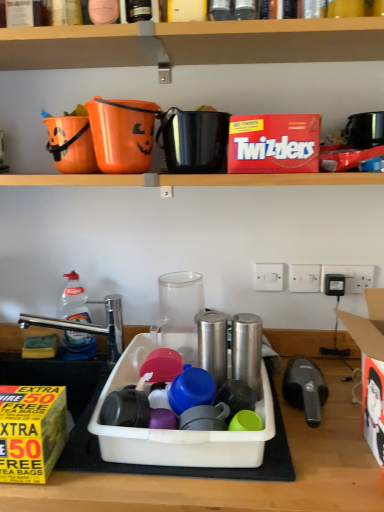
Question: Considering the relative sizes of orange plastic bucket at upper center, marked as the fifth appliance in a right-to-left arrangement, and red cardboard box at upper center, the second box from the left, in the image provided, is orange plastic bucket at upper center, marked as the fifth appliance in a right-to-left arrangement, taller than red cardboard box at upper center, the second box from the left,?

Choices:
 (A) yes
 (B) no

Answer: (A)

Question: From a real-world perspective, is orange plastic bucket at upper center, marked as the fifth appliance in a right-to-left arrangement, over red cardboard box at upper center, the first box in the right-to-left sequence?

Choices:
 (A) yes
 (B) no

Answer: (A)

Question: From the image's perspective, is orange plastic bucket at upper center, arranged as the 4th appliance when ordered from the bottom, above red cardboard box at upper center, the second box from the left?

Choices:
 (A) yes
 (B) no

Answer: (A)

Question: Is there a large distance between orange plastic bucket at upper center, the 2th appliance viewed from the top, and red cardboard box at upper center, the second box from the left?

Choices:
 (A) no
 (B) yes

Answer: (A)

Question: Is orange plastic bucket at upper center, the first appliance in the left-to-right sequence, smaller than red cardboard box at upper center, placed as the first box when sorted from back to front?

Choices:
 (A) no
 (B) yes

Answer: (B)

Question: Can you confirm if orange plastic bucket at upper center, marked as the fifth appliance in a right-to-left arrangement, is thinner than red cardboard box at upper center, the second box ordered from the bottom?

Choices:
 (A) no
 (B) yes

Answer: (A)

Question: Can you confirm if white plastic electric outlet at center, the second electric outlet from the left, is positioned to the right of chrome metallic faucet at left?

Choices:
 (A) no
 (B) yes

Answer: (B)

Question: Can you confirm if white plastic electric outlet at center, the second electric outlet from the left, is shorter than chrome metallic faucet at left?

Choices:
 (A) yes
 (B) no

Answer: (A)

Question: Can you confirm if white plastic electric outlet at center, the second electric outlet from the left, is smaller than chrome metallic faucet at left?

Choices:
 (A) yes
 (B) no

Answer: (A)

Question: Is white plastic electric outlet at center, the second electric outlet positioned from the right, looking in the opposite direction of chrome metallic faucet at left?

Choices:
 (A) yes
 (B) no

Answer: (B)

Question: Would you say white plastic electric outlet at center, the second electric outlet positioned from the right, is outside chrome metallic faucet at left?

Choices:
 (A) yes
 (B) no

Answer: (A)

Question: Does white plastic electric outlet at center, the second electric outlet positioned from the right, have a larger size compared to chrome metallic faucet at left?

Choices:
 (A) yes
 (B) no

Answer: (B)

Question: Considering the relative positions of wooden shelf at upper center and white plastic electric outlet at upper right, which ranks as the third electric outlet in left-to-right order, in the image provided, is wooden shelf at upper center to the left of white plastic electric outlet at upper right, which ranks as the third electric outlet in left-to-right order, from the viewer's perspective?

Choices:
 (A) no
 (B) yes

Answer: (B)